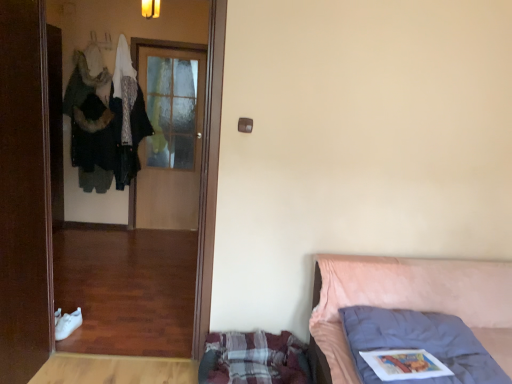
Question: Does plaid fabric mattress at lower center touch brown wooden door at left, the first door from the front?

Choices:
 (A) no
 (B) yes

Answer: (A)

Question: Considering the relative sizes of plaid fabric mattress at lower center and brown wooden door at left, the first door from the front, in the image provided, is plaid fabric mattress at lower center bigger than brown wooden door at left, the first door from the front,?

Choices:
 (A) yes
 (B) no

Answer: (B)

Question: From a real-world perspective, is plaid fabric mattress at lower center positioned under brown wooden door at left, marked as the 2th door in a back-to-front arrangement, based on gravity?

Choices:
 (A) no
 (B) yes

Answer: (B)

Question: Is plaid fabric mattress at lower center at the right side of brown wooden door at left, the first door from the front?

Choices:
 (A) yes
 (B) no

Answer: (A)

Question: From the image's perspective, is plaid fabric mattress at lower center over brown wooden door at left, the first door from the front?

Choices:
 (A) yes
 (B) no

Answer: (B)

Question: Can you confirm if plaid fabric mattress at lower center is thinner than brown wooden door at left, marked as the 2th door in a back-to-front arrangement?

Choices:
 (A) no
 (B) yes

Answer: (A)

Question: Is plaid fabric mattress at lower center not near pink fabric bed at right?

Choices:
 (A) no
 (B) yes

Answer: (A)

Question: From a real-world perspective, is plaid fabric mattress at lower center physically below pink fabric bed at right?

Choices:
 (A) yes
 (B) no

Answer: (A)

Question: Does plaid fabric mattress at lower center touch pink fabric bed at right?

Choices:
 (A) yes
 (B) no

Answer: (B)

Question: Considering the relative positions of plaid fabric mattress at lower center and pink fabric bed at right in the image provided, is plaid fabric mattress at lower center to the right of pink fabric bed at right from the viewer's perspective?

Choices:
 (A) yes
 (B) no

Answer: (B)

Question: Is plaid fabric mattress at lower center at the left side of pink fabric bed at right?

Choices:
 (A) yes
 (B) no

Answer: (A)

Question: Is pink fabric bed at right surrounded by plaid fabric mattress at lower center?

Choices:
 (A) yes
 (B) no

Answer: (B)

Question: Is wooden screen door at left further to the viewer compared to plaid fabric mattress at lower center?

Choices:
 (A) no
 (B) yes

Answer: (B)